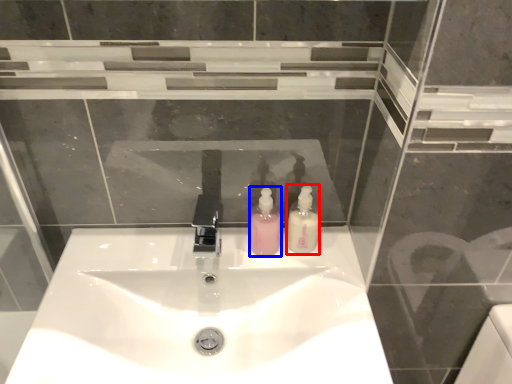
Question: Among these objects, which one is nearest to the camera, soap dispenser (highlighted by a red box) or soap dispenser (highlighted by a blue box)?

Choices:
 (A) soap dispenser
 (B) soap dispenser

Answer: (A)